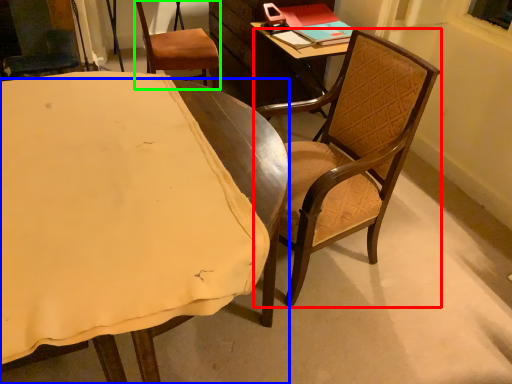
Question: Which is nearer to the chair (highlighted by a red box)? chair (highlighted by a blue box) or chair (highlighted by a green box).

Choices:
 (A) chair
 (B) chair

Answer: (A)